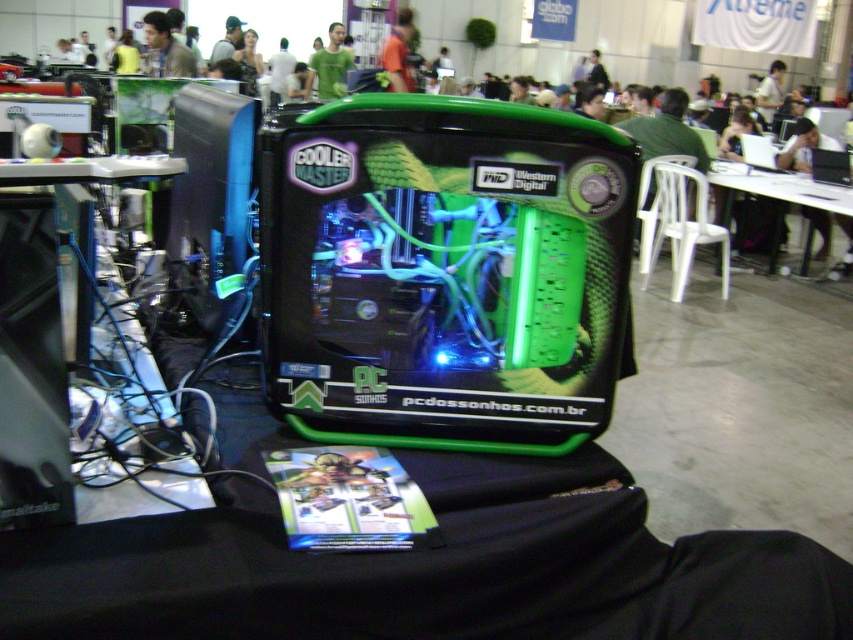
You are at a tech expo and see the green matte computer case at center and the white plastic table at lower right. Which object is positioned to the left side of the other?

The green matte computer case at center is to the left of white plastic table at lower right.

You are a photographer at the expo and want to take a closeup shot of the Cooler Master case. You notice two points of interest marked as point 1 and point 2. If point 1 is at coordinate (341, 67) and point 2 is at (111, 58), which point is closer to your camera lens?

Point 1 is closer to the camera lens because it is closer to the camera than point 2.